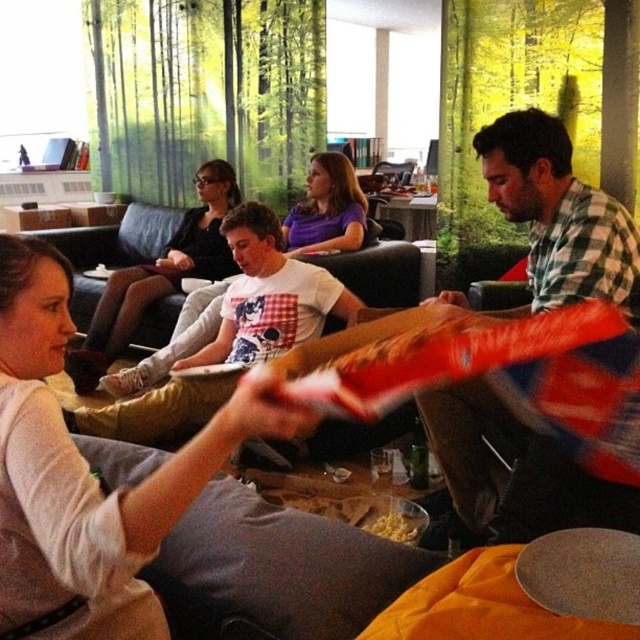
Question: Which object appears closest to the camera in this image?

Choices:
 (A) matte black shirt at center
 (B) white matte shirt at upper left
 (C) checkered fabric shirt at right

Answer: (B)

Question: Which object is farther from the camera taking this photo?

Choices:
 (A) black leather couch at center
 (B) checkered fabric shirt at right
 (C) purple matte shirt at center
 (D) white matte shirt at upper left

Answer: (C)

Question: Which point appears closest to the camera in this image?

Choices:
 (A) (573, 227)
 (B) (342, 236)
 (C) (308, 285)

Answer: (A)

Question: Does black leather couch at center appear over matte black shirt at center?

Choices:
 (A) no
 (B) yes

Answer: (A)

Question: Does white matte shirt at upper left appear under black leather couch at center?

Choices:
 (A) no
 (B) yes

Answer: (A)

Question: Can you confirm if white matte shirt at upper left is bigger than black leather couch at center?

Choices:
 (A) yes
 (B) no

Answer: (B)